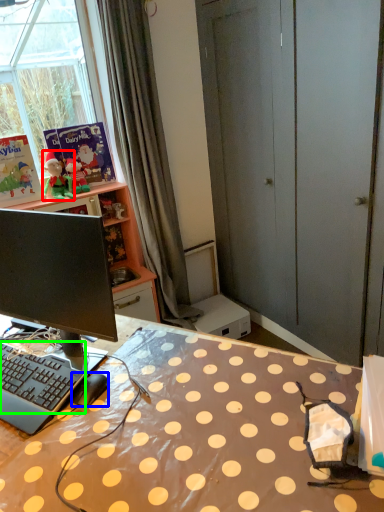
Question: Which object is the closest to the person (highlighted by a red box)? Choose among these: computer mouse (highlighted by a blue box) or computer keyboard (highlighted by a green box).

Choices:
 (A) computer mouse
 (B) computer keyboard

Answer: (B)